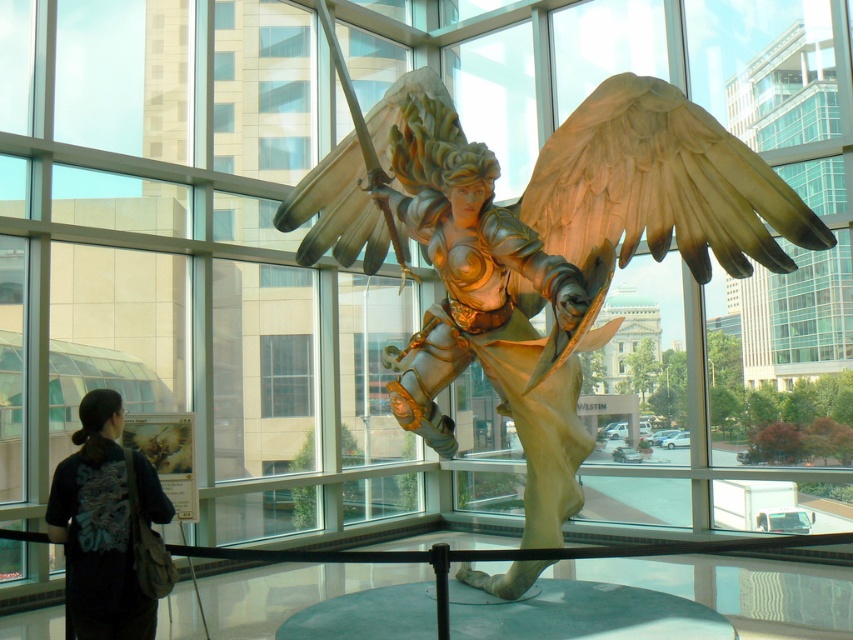
Question: Which object is farther from the camera taking this photo?

Choices:
 (A) bronze statue at center
 (B) black fabric bag at lower left

Answer: (A)

Question: Among these objects, which one is nearest to the camera?

Choices:
 (A) black fabric bag at lower left
 (B) bronze statue at center

Answer: (A)

Question: Is bronze statue at center to the right of black fabric bag at lower left from the viewer's perspective?

Choices:
 (A) no
 (B) yes

Answer: (B)

Question: Does bronze statue at center lie in front of black fabric bag at lower left?

Choices:
 (A) yes
 (B) no

Answer: (B)

Question: Does bronze statue at center have a lesser width compared to black fabric bag at lower left?

Choices:
 (A) yes
 (B) no

Answer: (B)

Question: Which point is closer to the camera?

Choices:
 (A) (146, 467)
 (B) (434, 337)

Answer: (A)